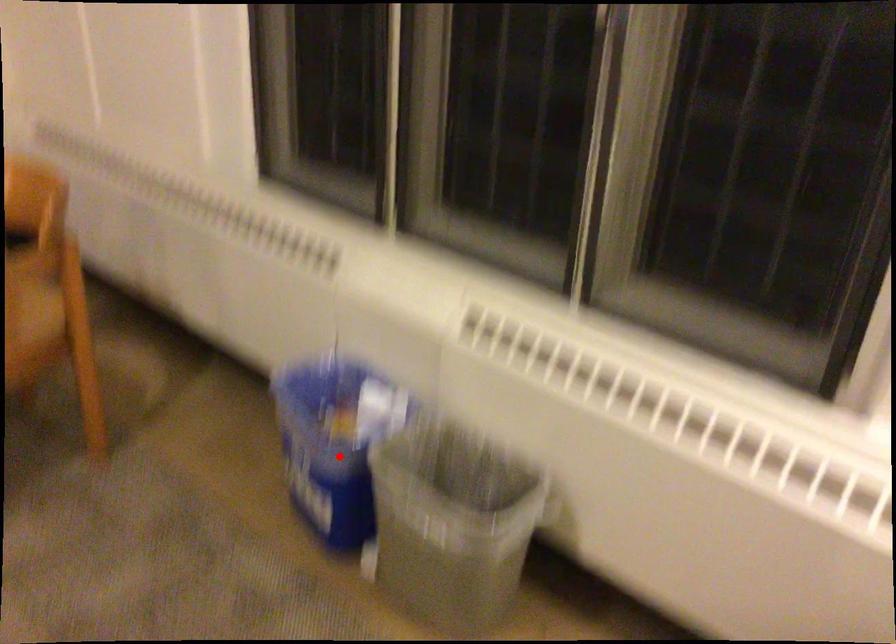
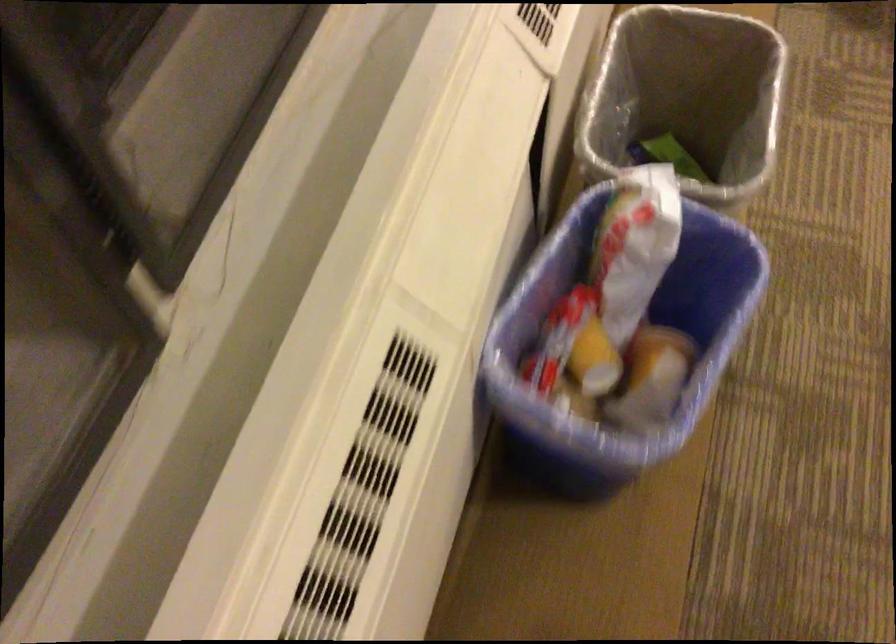
Question: A red point is marked in image1. In image2, is the corresponding 3D point closer to the camera or farther? Reply with the corresponding letter.

Choices:
 (A) The corresponding 3D point is closer.
 (B) The corresponding 3D point is farther.

Answer: (A)